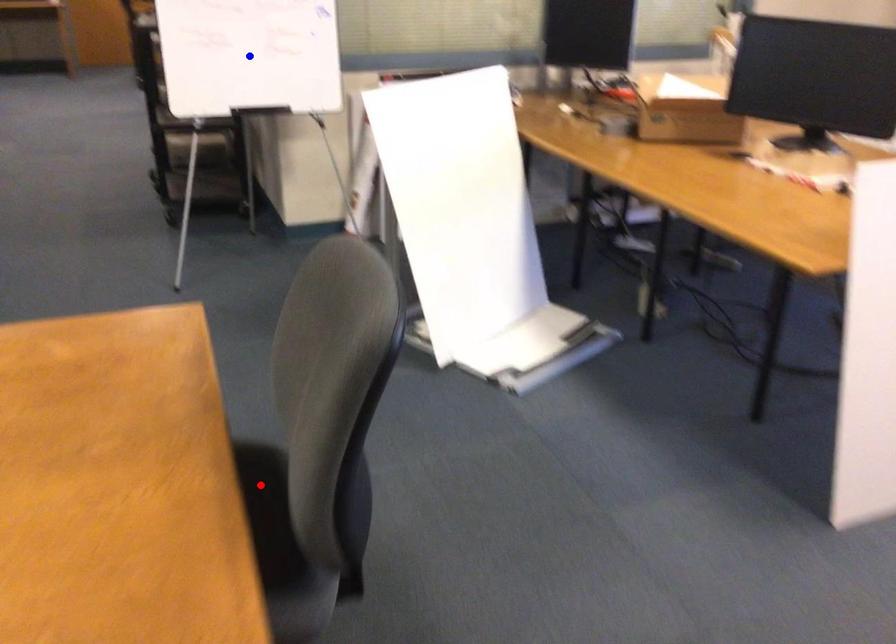
Question: Two points are marked on the image. Which point is closer to the camera?

Choices:
 (A) Blue point is closer.
 (B) Red point is closer.

Answer: (B)